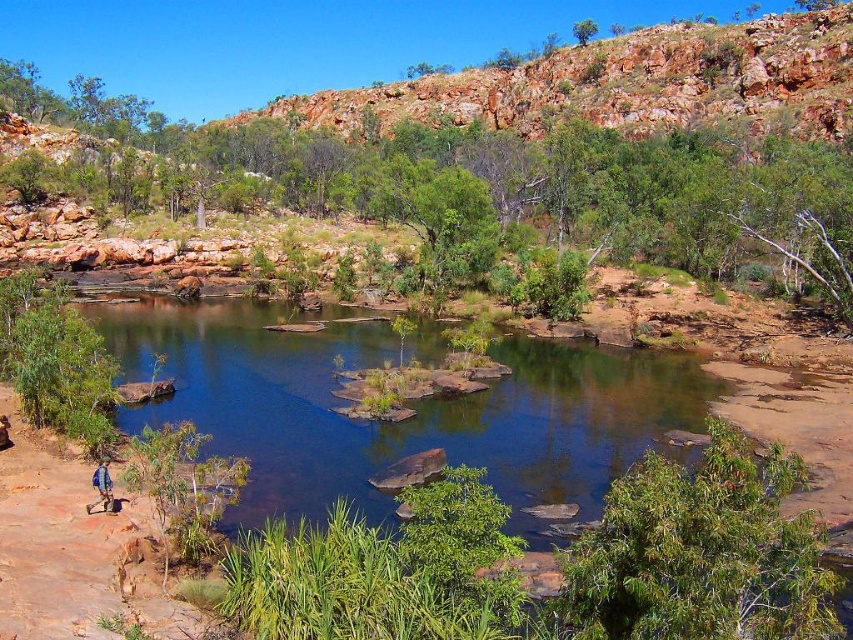
Question: Is clear water at center positioned at the back of blue fabric backpack at lower left?

Choices:
 (A) no
 (B) yes

Answer: (B)

Question: Among these points, which one is farthest from the camera?

Choices:
 (A) (106, 500)
 (B) (128, 316)

Answer: (B)

Question: Is clear water at center thinner than blue fabric backpack at lower left?

Choices:
 (A) yes
 (B) no

Answer: (B)

Question: Does clear water at center appear on the right side of blue fabric backpack at lower left?

Choices:
 (A) no
 (B) yes

Answer: (B)